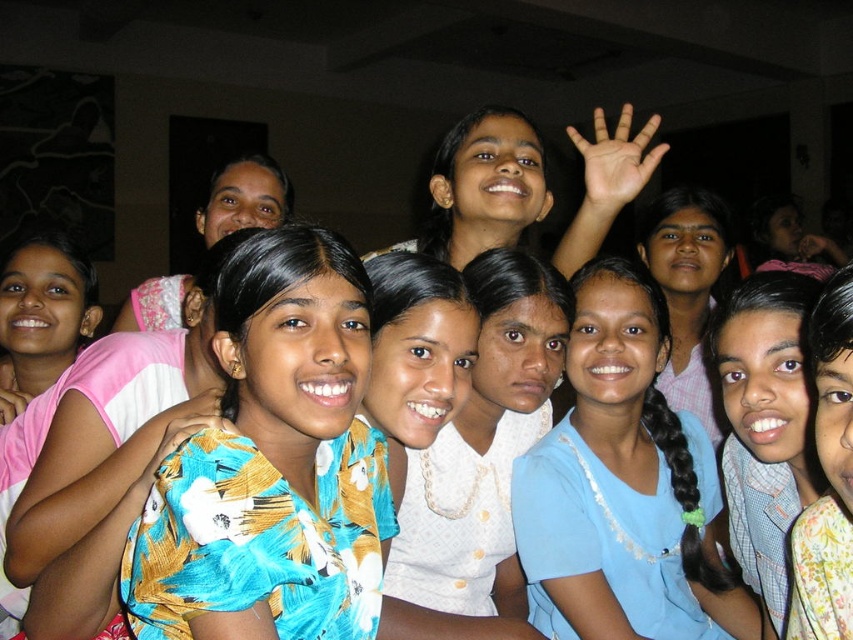
You are a photographer trying to adjust the lighting in the scene. You notice the matte yellow shirt at center and the matte pink blouse at upper left. Which object is covering part of the other?

The matte yellow shirt at center is positioned over the matte pink blouse at upper left, so the matte yellow shirt at center is covering part of the matte pink blouse at upper left.

You are a photographer trying to adjust the lighting for a group photo. You notice two items in the center of the image, the blue fabric at center and the floral fabric shirt at center. Which item is taller and might cast a longer shadow when the light is shone from above?

The blue fabric at center is taller than the floral fabric shirt at center, so it will cast a longer shadow when light is shone from above.

You are a photographer trying to adjust the lighting for a group shot. You notice the blue fabric at center and the brown skin hand at upper center. Which object is positioned to the left side of the other?

The blue fabric at center is to the left of brown skin hand at upper center.